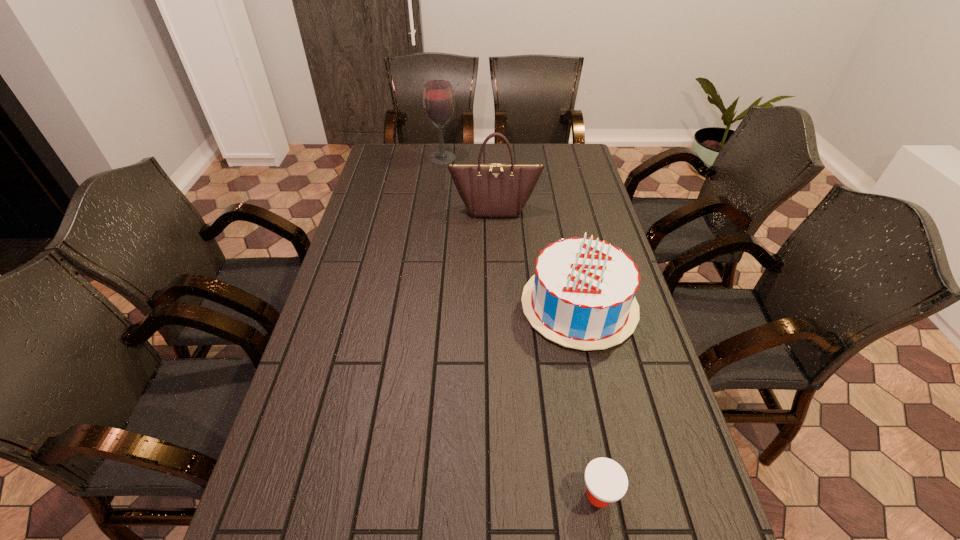
You are a GUI agent. You are given a task and a screenshot of the screen. Output one action in this format:
    pyautogui.click(x=<x>, y=<y>)
    Task: Click on the object present at the far edge
    Image resolution: width=960 pixels, height=540 pixels.
    Given the screenshot: What is the action you would take?
    tap(438, 99)

What are the coordinates of `object at the right edge` in the screenshot? It's located at (582, 296).

At what (x,y) coordinates should I click in order to perform the action: click on free space at the far edge of the desktop. Please return your answer as a coordinate pair (x, y). This screenshot has width=960, height=540. Looking at the image, I should click on (472, 150).

I want to click on vacant region at the left edge, so click(383, 201).

The width and height of the screenshot is (960, 540). Find the location of `free region at the right edge of the desktop`. free region at the right edge of the desktop is located at coordinates (564, 203).

The width and height of the screenshot is (960, 540). Identify the location of vacant space at the far right corner. (553, 151).

This screenshot has height=540, width=960. I want to click on free spot between the alcohol and the nearest object, so click(520, 327).

Locate an element on the screen. The height and width of the screenshot is (540, 960). free spot between the third nearest object and the birthday cake is located at coordinates (537, 258).

Image resolution: width=960 pixels, height=540 pixels. Find the location of `free spot between the shortest object and the third nearest object`. free spot between the shortest object and the third nearest object is located at coordinates (546, 352).

The image size is (960, 540). In order to click on free spot between the farthest object and the third farthest object in this screenshot , I will do `click(511, 232)`.